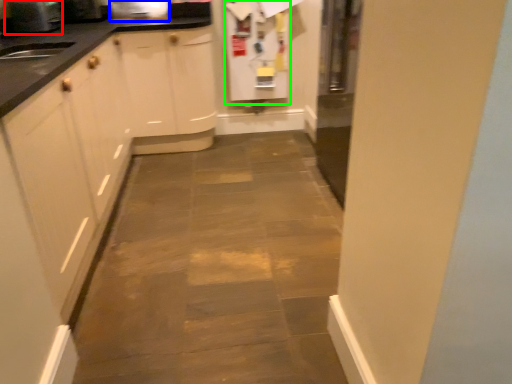
Question: Based on their relative distances, which object is farther from appliance (highlighted by a red box)? Choose from appliance (highlighted by a blue box) and appliance (highlighted by a green box).

Choices:
 (A) appliance
 (B) appliance

Answer: (B)